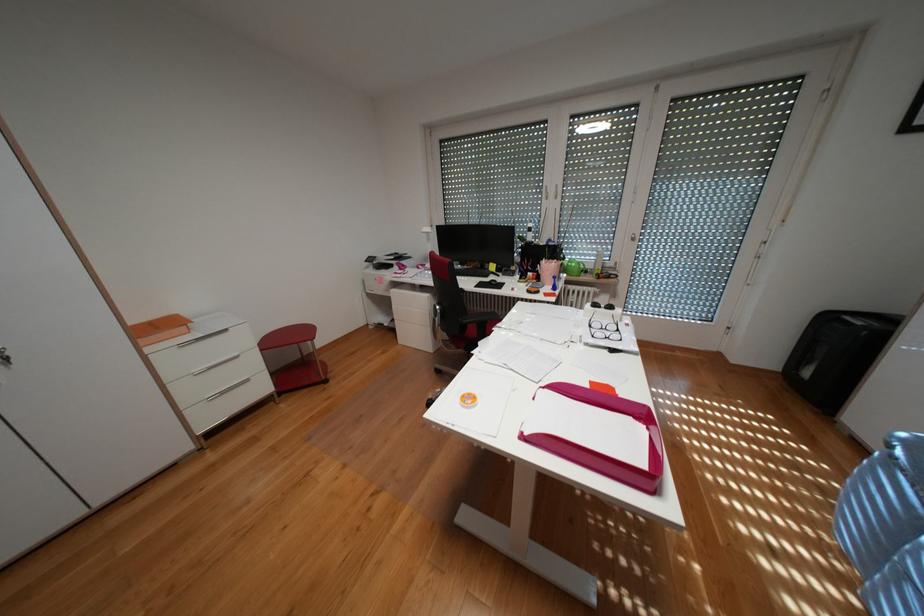
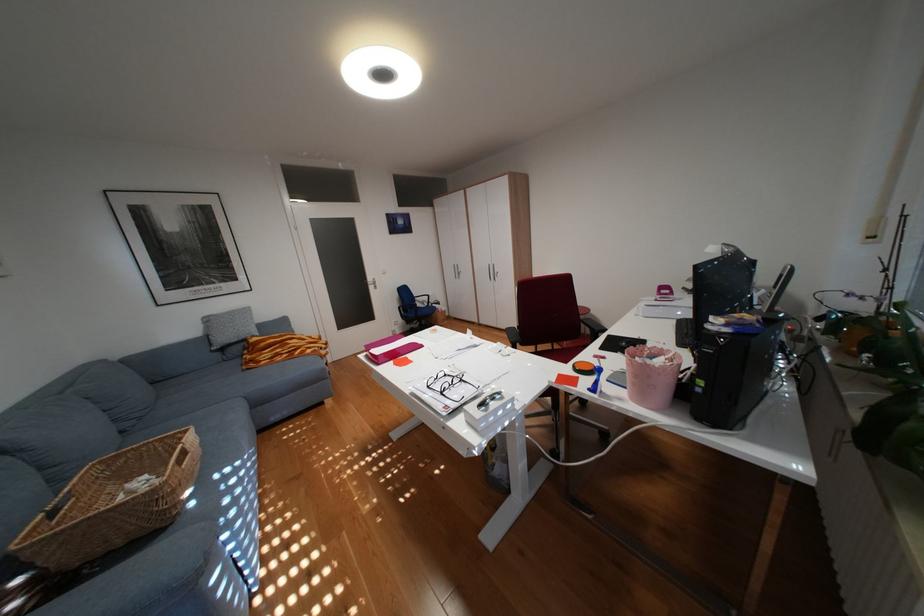
The point at (629, 330) is marked in the first image. Where is the corresponding point in the second image?

(454, 392)